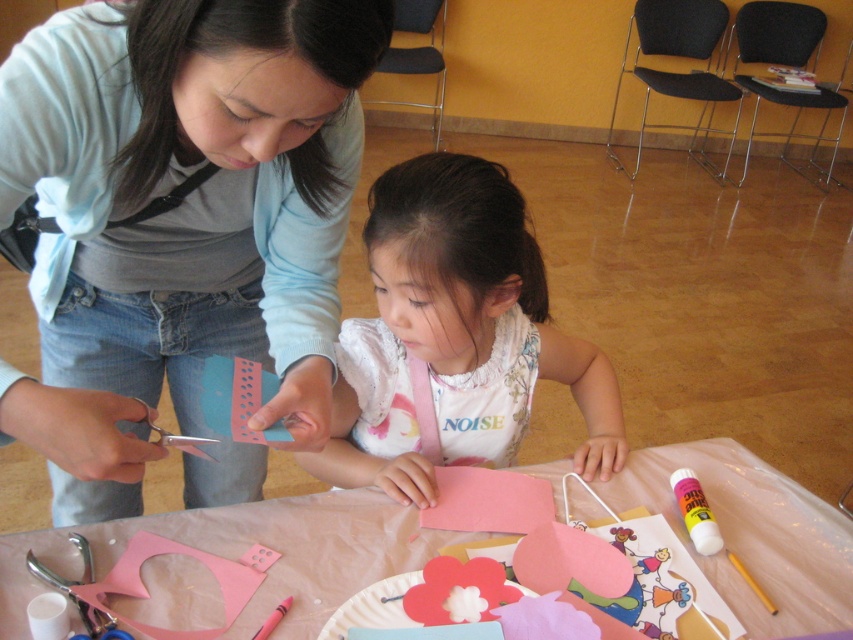
Question: Among these objects, which one is nearest to the camera?

Choices:
 (A) matte blue card at center
 (B) pink paper at center
 (C) white cotton shirt at center

Answer: (A)

Question: Is the position of matte blue card at center less distant than that of pink paper at center?

Choices:
 (A) yes
 (B) no

Answer: (A)

Question: Considering the relative positions of matte blue card at center and white cotton shirt at center in the image provided, where is matte blue card at center located with respect to white cotton shirt at center?

Choices:
 (A) left
 (B) right

Answer: (A)

Question: Where is matte blue card at center located in relation to pink paper at center in the image?

Choices:
 (A) above
 (B) below

Answer: (A)

Question: Which point is farther to the camera?

Choices:
 (A) white cotton shirt at center
 (B) pink paper at center

Answer: (A)

Question: Which of the following is the farthest from the observer?

Choices:
 (A) white cotton shirt at center
 (B) matte blue card at center

Answer: (A)